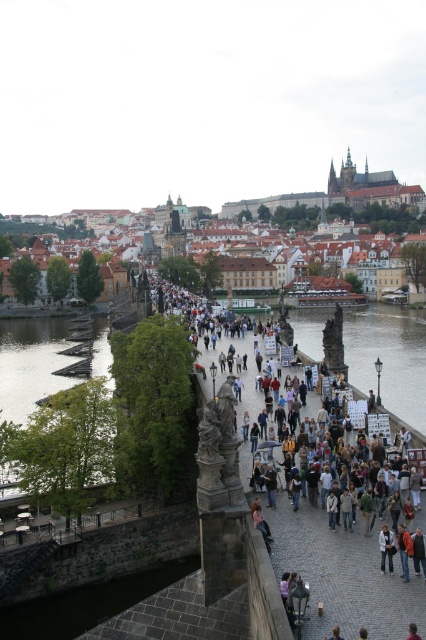
Is dark gray stone waterway at lower left above blonde hair at center?

Actually, dark gray stone waterway at lower left is below blonde hair at center.

The image size is (426, 640). Identify the location of dark gray stone waterway at lower left. (x=88, y=604).

At what (x,y) coordinates should I click in order to perform the action: click on dark gray stone waterway at lower left. Please return your answer as a coordinate pair (x, y). The height and width of the screenshot is (640, 426). Looking at the image, I should click on (88, 604).

Which is more to the left, clear water at center or brown leather jacket at center?

Positioned to the left is brown leather jacket at center.

Consider the image. Does clear water at center have a greater width compared to brown leather jacket at center?

Yes, clear water at center is wider than brown leather jacket at center.

Is point (408, 317) more distant than point (411, 636)?

Yes, point (408, 317) is behind point (411, 636).

Identify the location of clear water at center. Image resolution: width=426 pixels, height=640 pixels. (388, 356).

Can you confirm if brown stone prague castle at upper center is taller than blonde hair at center?

Indeed, brown stone prague castle at upper center has a greater height compared to blonde hair at center.

Which is behind, point (374, 180) or point (333, 637)?

Positioned behind is point (374, 180).

Where is `brown stone prague castle at upper center`? The image size is (426, 640). brown stone prague castle at upper center is located at coordinates (342, 198).